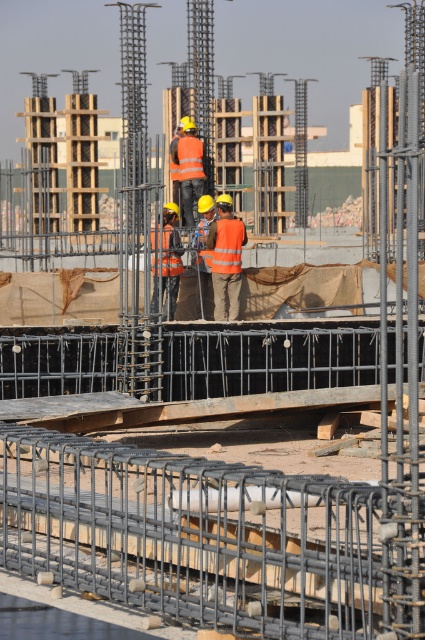
Does reflective orange vest at center have a lesser height compared to orange reflective vest at center?

No, reflective orange vest at center is not shorter than orange reflective vest at center.

Is point (223, 301) less distant than point (163, 212)?

No.

Who is more distant from viewer, [238,284] or [172,305]?

Point [238,284]

I want to click on reflective orange vest at center, so click(226, 259).